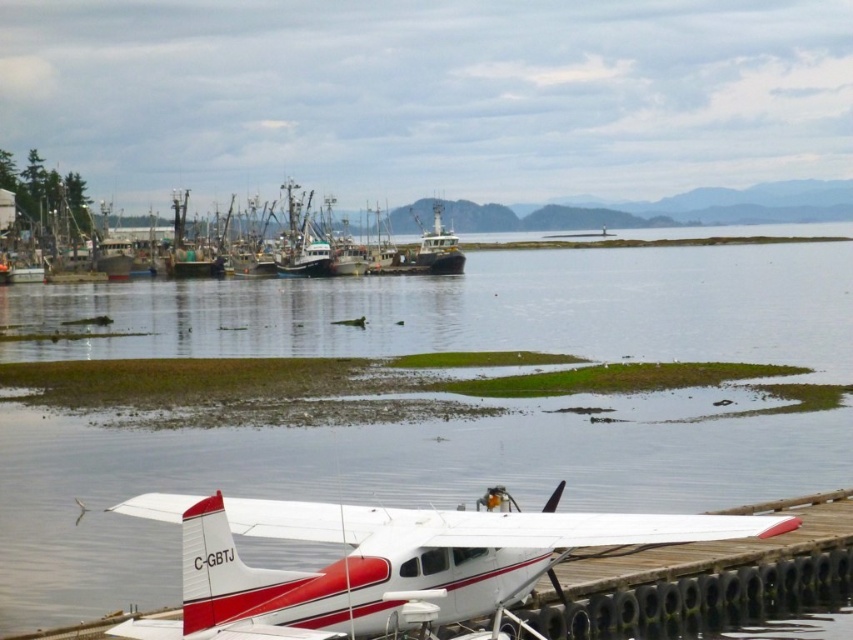
Question: Can you confirm if white matte airplane at lower center is bigger than green matte fishing boat at left?

Choices:
 (A) no
 (B) yes

Answer: (A)

Question: Can you confirm if green matte fishing boat at left is thinner than green matte fishing boat at center?

Choices:
 (A) no
 (B) yes

Answer: (A)

Question: Can you confirm if white matte airplane at lower center is positioned above green matte fishing boat at left?

Choices:
 (A) no
 (B) yes

Answer: (A)

Question: Among these objects, which one is farthest from the camera?

Choices:
 (A) white matte airplane at lower center
 (B) green matte fishing boat at left

Answer: (B)

Question: Which of the following is the farthest from the observer?

Choices:
 (A) (437, 205)
 (B) (462, 577)
 (C) (24, 212)

Answer: (C)

Question: Based on their relative distances, which object is farther from the white matte airplane at lower center?

Choices:
 (A) green matte fishing boat at center
 (B) clear water at center

Answer: (A)